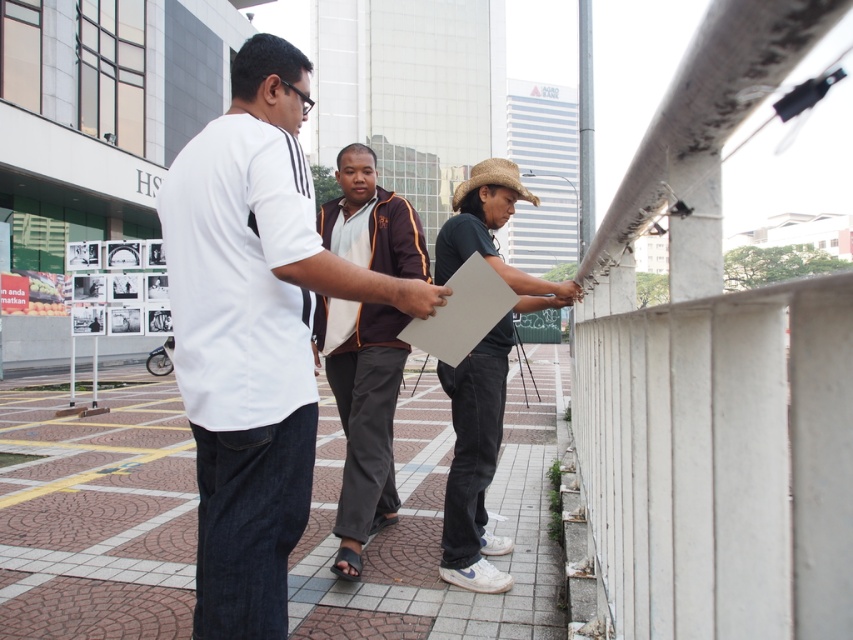
You are standing at the point marked as point (97, 516) in the image. What material is the ground made of at that location?

The ground at point (97, 516) is made of brick paved material.

You are a delivery person who needs to place a 24 inch wide package between the white matte shirt at center and the brown fabric jacket at center. Can you fit the package between them without moving either person?

The distance between the white matte shirt at center and the brown fabric jacket at center is 37.85 inches, so yes, the 24 inch wide package can fit between them since it is narrower than the available space.